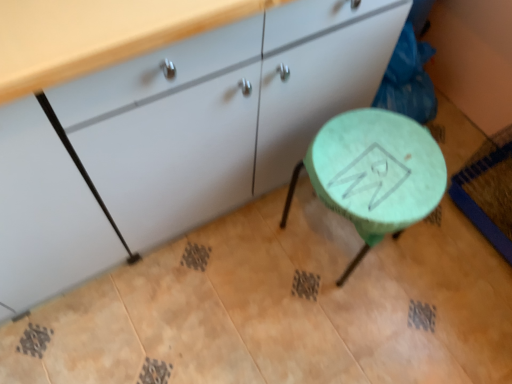
This screenshot has height=384, width=512. I want to click on vacant space situated on the left part of green matte stool at center, so click(x=254, y=248).